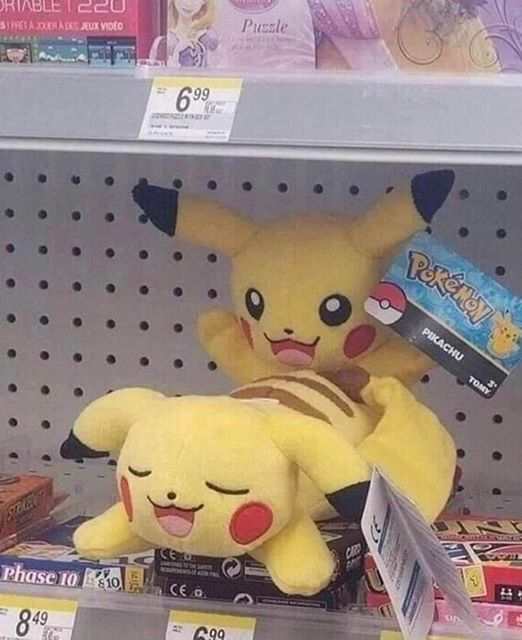
Image resolution: width=522 pixels, height=640 pixels. In order to click on shelf in this screenshot , I will do `click(299, 123)`, `click(71, 104)`, `click(106, 618)`, `click(288, 624)`.